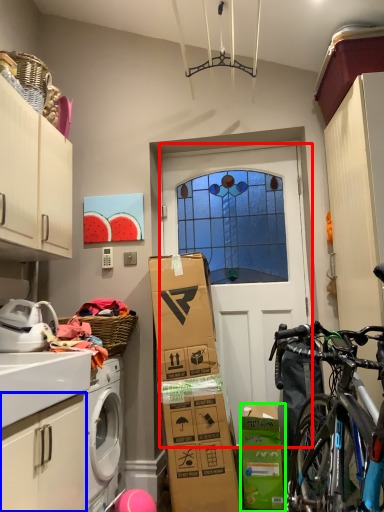
Question: Which object is positioned farthest from door (highlighted by a red box)? Select from cabinetry (highlighted by a blue box) and cardboard box (highlighted by a green box).

Choices:
 (A) cabinetry
 (B) cardboard box

Answer: (A)